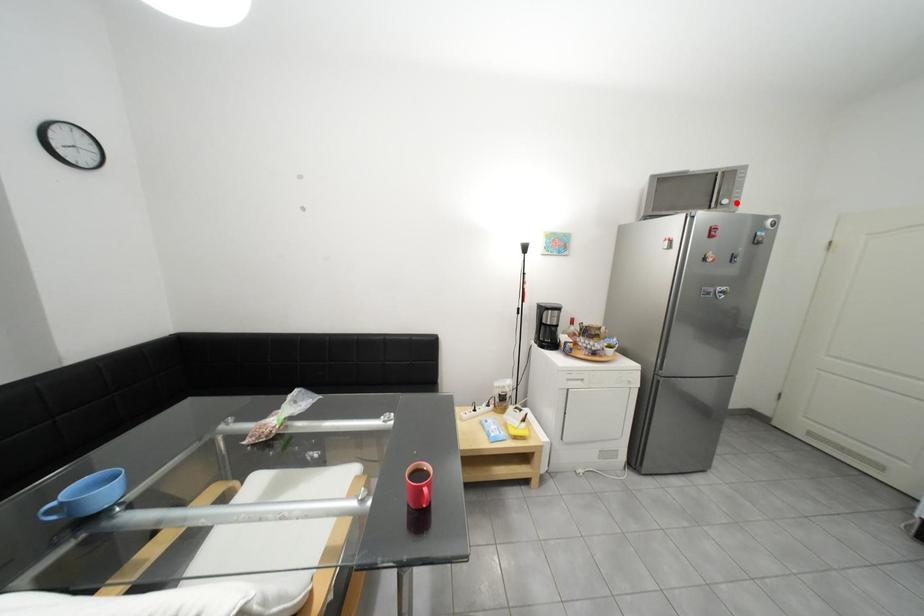
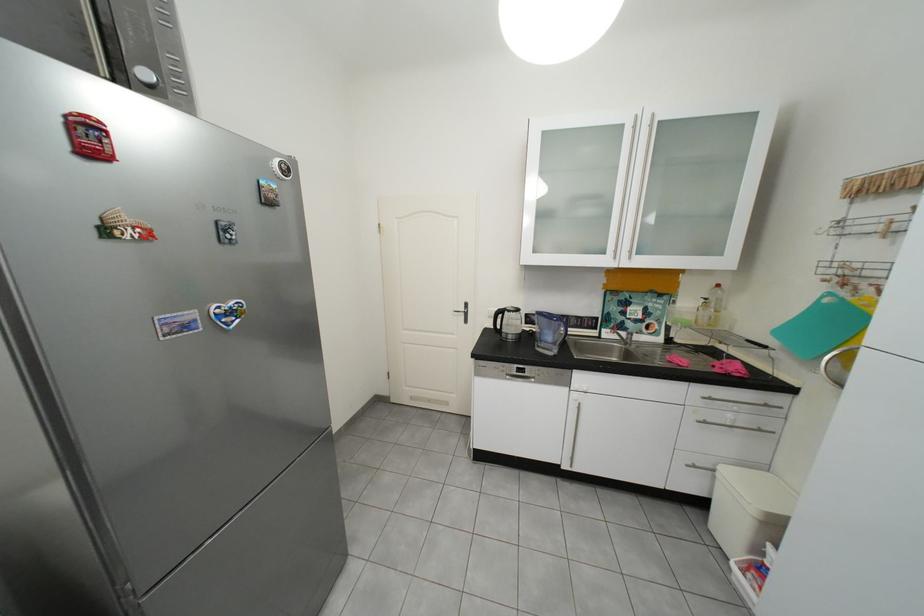
In the second image, find the point that corresponds to the highlighted location in the first image.

(156, 75)